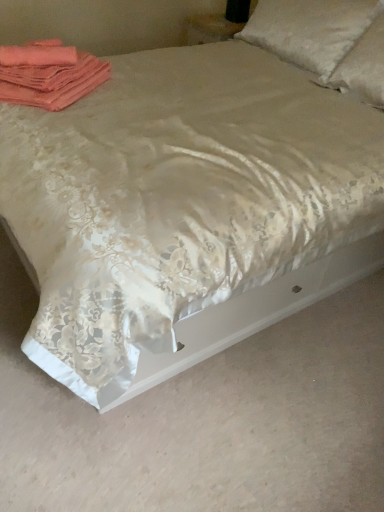
Question: Is white satin pillow at upper right, which is the first pillow in left-to-right order, further to camera compared to coral fabric towels at upper left?

Choices:
 (A) yes
 (B) no

Answer: (A)

Question: Considering the relative sizes of white satin pillow at upper right, which is the first pillow in left-to-right order, and coral fabric towels at upper left in the image provided, is white satin pillow at upper right, which is the first pillow in left-to-right order, bigger than coral fabric towels at upper left?

Choices:
 (A) yes
 (B) no

Answer: (A)

Question: From the image's perspective, is white satin pillow at upper right, which is the first pillow in left-to-right order, on coral fabric towels at upper left?

Choices:
 (A) yes
 (B) no

Answer: (A)

Question: Is white satin pillow at upper right, which is the first pillow in left-to-right order, not near coral fabric towels at upper left?

Choices:
 (A) yes
 (B) no

Answer: (A)

Question: Is white satin pillow at upper right, which is the first pillow in left-to-right order, touching coral fabric towels at upper left?

Choices:
 (A) no
 (B) yes

Answer: (A)

Question: Based on their positions, is white satin pillow at upper right, which is the first pillow in left-to-right order, located to the left or right of satin white pillow at upper right, the 2th pillow from the left?

Choices:
 (A) right
 (B) left

Answer: (B)

Question: From a real-world perspective, is white satin pillow at upper right, the second pillow from the right, positioned above or below satin white pillow at upper right, the first pillow in the right-to-left sequence?

Choices:
 (A) above
 (B) below

Answer: (B)

Question: In terms of height, does white satin pillow at upper right, which is the first pillow in left-to-right order, look taller or shorter compared to satin white pillow at upper right, the 2th pillow from the left?

Choices:
 (A) tall
 (B) short

Answer: (B)

Question: Do you think white satin pillow at upper right, which is the first pillow in left-to-right order, is within satin white pillow at upper right, the first pillow in the right-to-left sequence, or outside of it?

Choices:
 (A) inside
 (B) outside

Answer: (B)

Question: Is coral fabric towels at upper left in front of or behind white satin pillow at upper right, the second pillow from the right, in the image?

Choices:
 (A) front
 (B) behind

Answer: (A)

Question: Is coral fabric towels at upper left taller or shorter than white satin pillow at upper right, the second pillow from the right?

Choices:
 (A) tall
 (B) short

Answer: (B)

Question: Is point (49, 80) positioned closer to the camera than point (283, 32)?

Choices:
 (A) farther
 (B) closer

Answer: (B)

Question: Looking at their shapes, would you say coral fabric towels at upper left is wider or thinner than white satin pillow at upper right, the second pillow from the right?

Choices:
 (A) wide
 (B) thin

Answer: (B)

Question: Considering the positions of satin white pillow at upper right, the 2th pillow from the left, and white satin pillow at upper right, which is the first pillow in left-to-right order, in the image, is satin white pillow at upper right, the 2th pillow from the left, wider or thinner than white satin pillow at upper right, which is the first pillow in left-to-right order,?

Choices:
 (A) thin
 (B) wide

Answer: (B)

Question: Considering their positions, is satin white pillow at upper right, the 2th pillow from the left, located in front of or behind white satin pillow at upper right, the second pillow from the right?

Choices:
 (A) front
 (B) behind

Answer: (A)